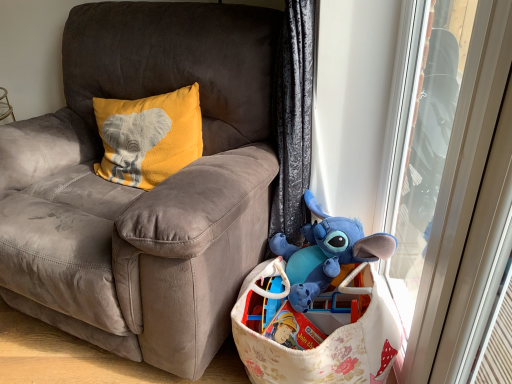
Question: From a real-world perspective, is transparent plastic screen door at right located higher than suede gray chair at center?

Choices:
 (A) yes
 (B) no

Answer: (A)

Question: Can you confirm if transparent plastic screen door at right is taller than suede gray chair at center?

Choices:
 (A) yes
 (B) no

Answer: (A)

Question: Considering the relative sizes of transparent plastic screen door at right and suede gray chair at center in the image provided, is transparent plastic screen door at right wider than suede gray chair at center?

Choices:
 (A) yes
 (B) no

Answer: (B)

Question: Can you confirm if transparent plastic screen door at right is bigger than suede gray chair at center?

Choices:
 (A) yes
 (B) no

Answer: (B)

Question: Is transparent plastic screen door at right turned away from suede gray chair at center?

Choices:
 (A) yes
 (B) no

Answer: (B)

Question: Considering the positions of point (144, 23) and point (440, 253), is point (144, 23) closer or farther from the camera than point (440, 253)?

Choices:
 (A) closer
 (B) farther

Answer: (B)

Question: From the image's perspective, is suede gray chair at center located above or below transparent plastic screen door at right?

Choices:
 (A) above
 (B) below

Answer: (A)

Question: Considering their positions, is suede gray chair at center located in front of or behind transparent plastic screen door at right?

Choices:
 (A) front
 (B) behind

Answer: (A)

Question: From a real-world perspective, is suede gray chair at center physically located above or below transparent plastic screen door at right?

Choices:
 (A) below
 (B) above

Answer: (A)

Question: Considering the positions of fluffy white fabric basket at lower right and suede gray chair at center in the image, is fluffy white fabric basket at lower right bigger or smaller than suede gray chair at center?

Choices:
 (A) big
 (B) small

Answer: (B)

Question: Which is correct: fluffy white fabric basket at lower right is inside suede gray chair at center, or outside of it?

Choices:
 (A) inside
 (B) outside

Answer: (B)

Question: Looking at their shapes, would you say fluffy white fabric basket at lower right is wider or thinner than suede gray chair at center?

Choices:
 (A) wide
 (B) thin

Answer: (B)

Question: Considering the relative positions of fluffy white fabric basket at lower right and suede gray chair at center in the image provided, is fluffy white fabric basket at lower right to the left or to the right of suede gray chair at center?

Choices:
 (A) left
 (B) right

Answer: (B)

Question: Is transparent plastic screen door at right to the left or to the right of fluffy white fabric basket at lower right in the image?

Choices:
 (A) left
 (B) right

Answer: (B)

Question: From the image's perspective, relative to fluffy white fabric basket at lower right, is transparent plastic screen door at right above or below?

Choices:
 (A) above
 (B) below

Answer: (A)